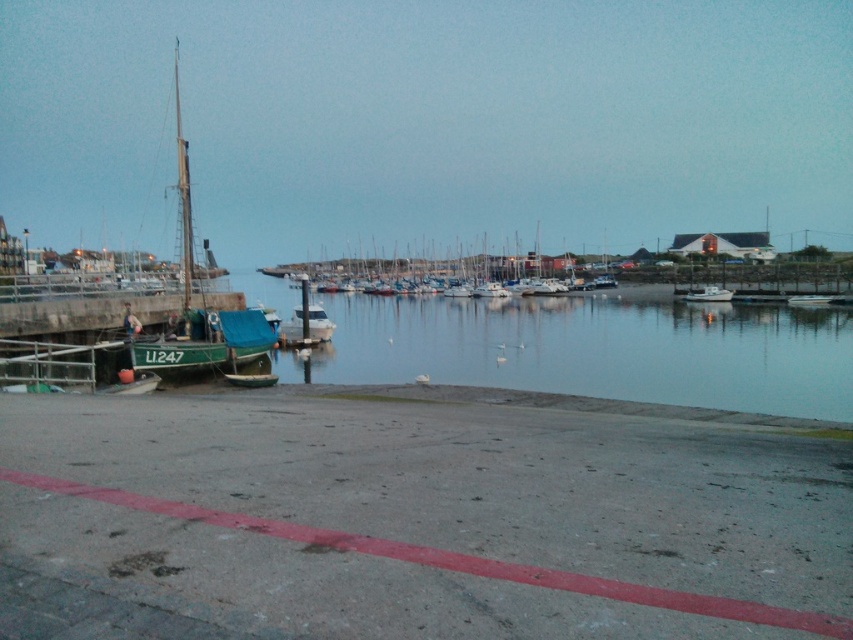
Question: Can you confirm if green matte sailboat at left is positioned to the left of white matte boat at center-right?

Choices:
 (A) yes
 (B) no

Answer: (A)

Question: Which of the following is the closest to the observer?

Choices:
 (A) green matte sailboat at left
 (B) white matte boat at center-right
 (C) white matte boats at center

Answer: (A)

Question: Can you confirm if green matte sailboat at left is positioned to the left of white matte boat at center-right?

Choices:
 (A) no
 (B) yes

Answer: (B)

Question: Which object appears farthest from the camera in this image?

Choices:
 (A) white matte boat at center-right
 (B) green matte sailboat at left

Answer: (A)

Question: Can you confirm if white matte boats at center is positioned to the right of white matte boat at center-right?

Choices:
 (A) no
 (B) yes

Answer: (A)

Question: Which object is closer to the camera taking this photo?

Choices:
 (A) green matte sailboat at left
 (B) white matte boat at center-right
 (C) white matte boats at center

Answer: (A)